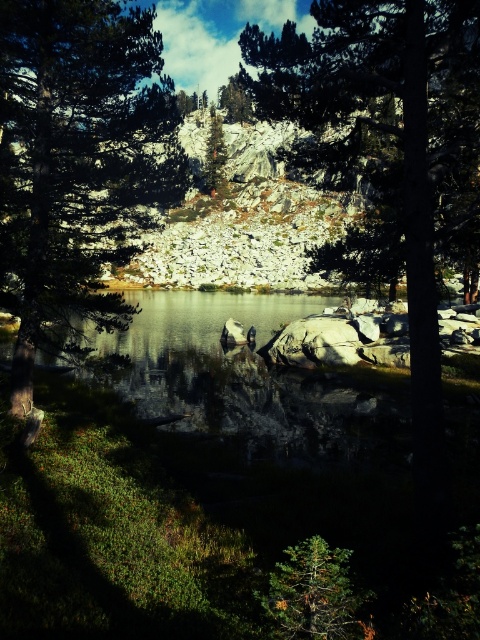
Image resolution: width=480 pixels, height=640 pixels. Describe the element at coordinates (314, 593) in the screenshot. I see `green matte tree at center` at that location.

Between green matte tree at center and green matte tree at upper center, which one is positioned higher?

green matte tree at upper center is higher up.

I want to click on green matte tree at center, so click(x=314, y=593).

Is point (168, 200) positioned behind point (324, 605)?

Yes, point (168, 200) is farther from viewer.

Measure the distance between point (70, 28) and camera.

Point (70, 28) and camera are 14.46 meters apart.

Locate an element on the screen. The height and width of the screenshot is (640, 480). green textured tree at center is located at coordinates (76, 164).

Is green textured tree at center wider than green textured pine tree at center?

Indeed, green textured tree at center has a greater width compared to green textured pine tree at center.

Does green textured tree at center have a smaller size compared to green textured pine tree at center?

No.

Which is behind, point (108, 92) or point (217, 157)?

Point (217, 157)

Image resolution: width=480 pixels, height=640 pixels. In order to click on green textured tree at center in this screenshot , I will do `click(76, 164)`.